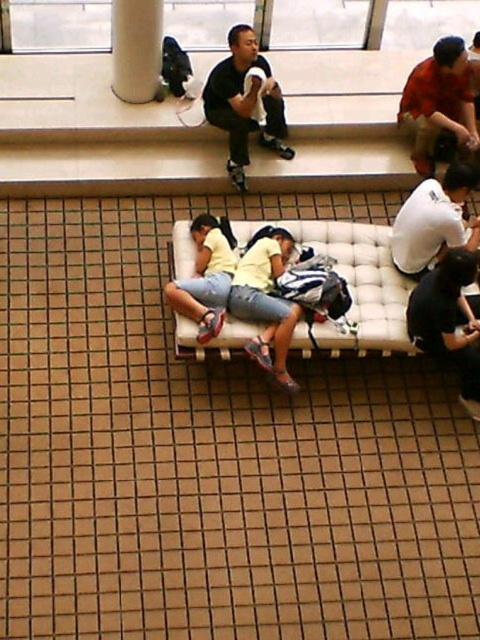
Between reddish-orange shirt at center and matte yellow shirt at center, which one has more height?

Standing taller between the two is reddish-orange shirt at center.

Based on the photo, is reddish-orange shirt at center above matte yellow shirt at center?

Yes.

What do you see at coordinates (439, 104) in the screenshot?
I see `reddish-orange shirt at center` at bounding box center [439, 104].

Find the location of a particular element. reddish-orange shirt at center is located at coordinates (439, 104).

Which is in front, point (292, 243) or point (155, 65)?

Point (292, 243) is in front.

I want to click on yellow fabric shirt at center, so click(x=265, y=300).

Which of these two, black matte shirt at upper center or white matte shirt at center, stands taller?

With more height is black matte shirt at upper center.

In the scene shown: How much distance is there between black matte shirt at upper center and white matte shirt at center?

black matte shirt at upper center and white matte shirt at center are 2.02 meters apart from each other.

You are a GUI agent. You are given a task and a screenshot of the screen. Output one action in this format:
    pyautogui.click(x=<x>, y=<y>)
    Task: Click on the black matte shirt at upper center
    This screenshot has height=640, width=480.
    Given the screenshot: What is the action you would take?
    pyautogui.click(x=244, y=102)

You are a GUI agent. You are given a task and a screenshot of the screen. Output one action in this format:
    pyautogui.click(x=<x>, y=<y>)
    Task: Click on the black matte shirt at upper center
    This screenshot has height=640, width=480.
    Given the screenshot: What is the action you would take?
    pyautogui.click(x=244, y=102)